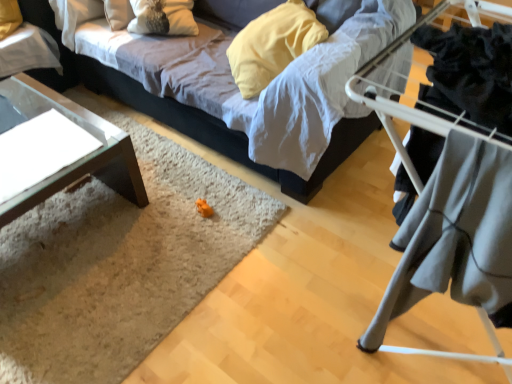
I want to click on free point above transparent glass table at lower left, which is the 1th table in bottom-to-top order (from a real-world perspective), so click(x=37, y=132).